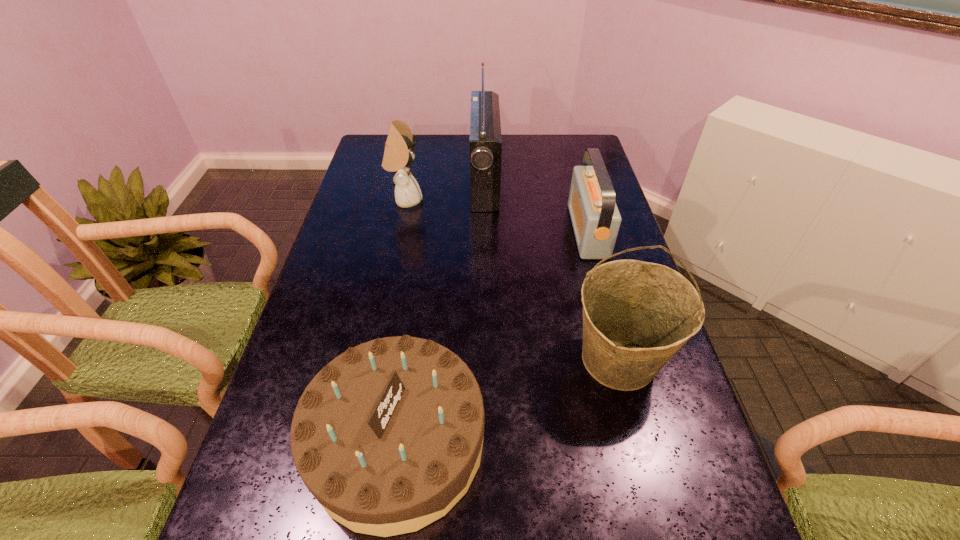
Locate an element on the screen. This screenshot has width=960, height=540. the left radio receiver is located at coordinates (485, 141).

The height and width of the screenshot is (540, 960). I want to click on wine bucket, so click(x=636, y=315).

Identify the location of the third tallest object. The height and width of the screenshot is (540, 960). (398, 155).

The width and height of the screenshot is (960, 540). Find the location of `the right radio receiver`. the right radio receiver is located at coordinates (595, 217).

What are the coordinates of `the shorter radio receiver` in the screenshot? It's located at (595, 217).

What are the coordinates of `the shortest object` in the screenshot? It's located at (388, 436).

At what (x,y) coordinates should I click in order to perform the action: click on free space located 0.150m on the front-facing side of the left radio receiver. Please return your answer as a coordinate pair (x, y). The height and width of the screenshot is (540, 960). Looking at the image, I should click on click(x=426, y=182).

Locate an element on the screen. Image resolution: width=960 pixels, height=540 pixels. blank space located 0.290m on the front-facing side of the left radio receiver is located at coordinates (386, 182).

Where is `vacant point located 0.080m on the front-facing side of the left radio receiver`? The image size is (960, 540). vacant point located 0.080m on the front-facing side of the left radio receiver is located at coordinates (447, 182).

This screenshot has width=960, height=540. Find the location of `vacant space positioned on the left of the wine bucket`. vacant space positioned on the left of the wine bucket is located at coordinates (470, 359).